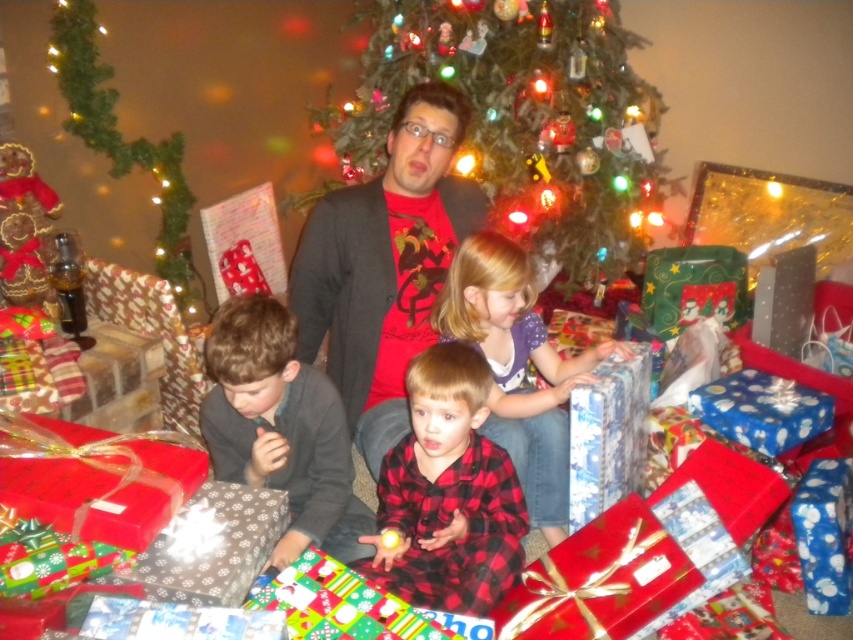
You are standing in front of the Christmas tree and want to walk towards the table with gifts. There are two points marked on the floor in front of you. The first is at point [444,545] and the second is at point [247,588]. Which point should you step on first to reach the table safely?

You should step on point [444,545] first because it is closer to you than point [247,588], which is further away from your current position.

You are a guest at the Christmas party and you see the red plaid shirt at center and the silver metallic gift at lower left. Which one is located on the right side of the other?

The red plaid shirt at center is to the right of the silver metallic gift at lower left, so the red plaid shirt at center is on the right side of the silver metallic gift at lower left.

You are a gift organizer at a store and need to place the plaid fabric shirt at center and the blue shiny gift at center into boxes. The boxes you have are exactly the same size as the items. Which item requires a wider box?

The plaid fabric shirt at center might be wider than blue shiny gift at center, so the plaid fabric shirt at center requires a wider box.